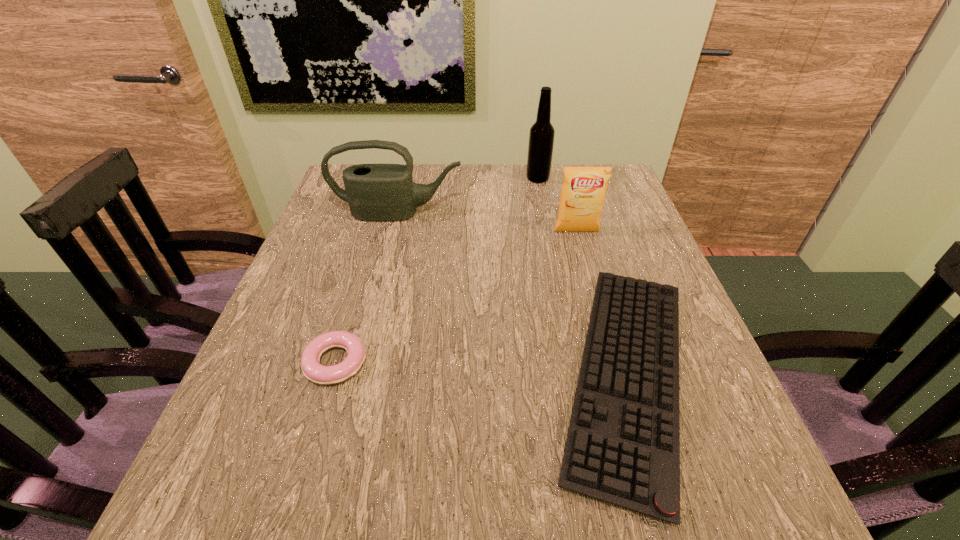
Identify the location of vacant space at the far edge. (439, 172).

I want to click on blank space at the near edge of the desktop, so click(x=350, y=502).

At what (x,y) coordinates should I click in order to perform the action: click on vacant space at the left edge of the desktop. Please return your answer as a coordinate pair (x, y). This screenshot has width=960, height=540. Looking at the image, I should click on (350, 281).

Identify the location of vacant region at the right edge of the desktop. (589, 241).

The image size is (960, 540). Identify the location of free spot between the doughnut and the computer keyboard. (482, 368).

At what (x,y) coordinates should I click in order to perform the action: click on free spot between the doughnut and the tallest object. Please return your answer as a coordinate pair (x, y). The image size is (960, 540). Looking at the image, I should click on (437, 271).

Find the location of a particular element. vacant region between the crisp (potato chip) and the second farthest object is located at coordinates (487, 222).

Image resolution: width=960 pixels, height=540 pixels. What are the coordinates of `vacant space that's between the doughnut and the farthest object` in the screenshot? It's located at click(x=437, y=271).

The height and width of the screenshot is (540, 960). Find the location of `blank region between the doughnut and the computer keyboard`. blank region between the doughnut and the computer keyboard is located at coordinates (482, 368).

This screenshot has height=540, width=960. I want to click on empty space between the tallest object and the watering can, so click(x=468, y=196).